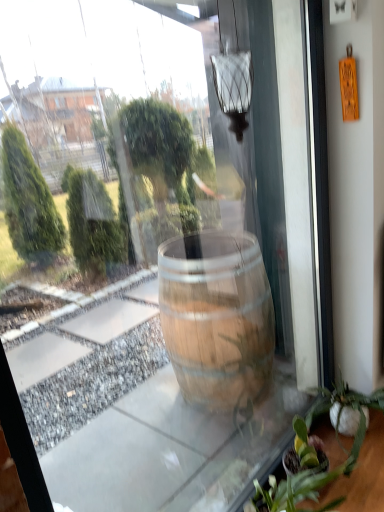
The height and width of the screenshot is (512, 384). I want to click on green matte plant at lower right, so click(x=315, y=452).

Describe the element at coordinates (315, 452) in the screenshot. I see `green matte plant at lower right` at that location.

In order to face green matte plant at lower right, should I rotate leftwards or rightwards?

Turn right approximately 16.042 degrees to face it.

Locate an element on the screen. Image resolution: width=384 pixels, height=512 pixels. green matte plant at lower right is located at coordinates (315, 452).